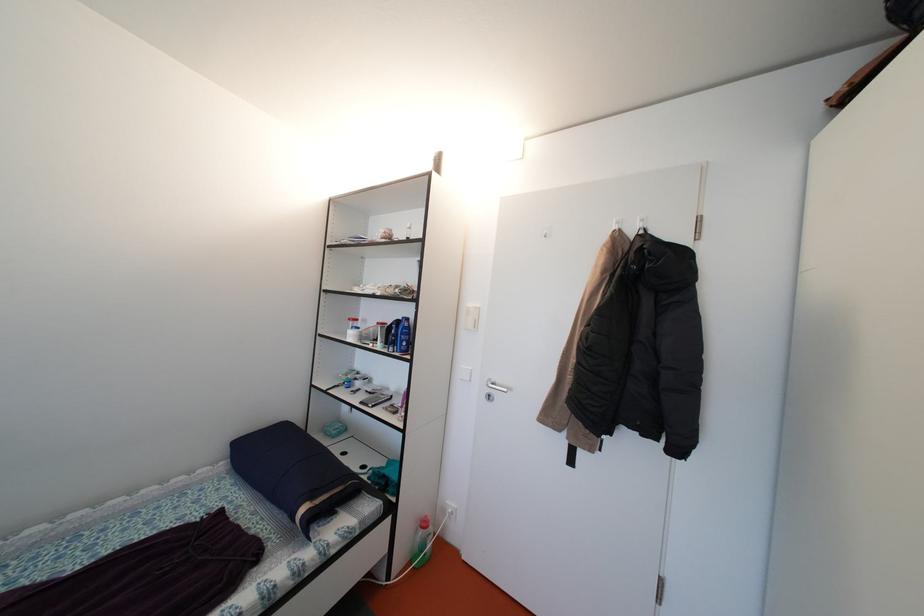
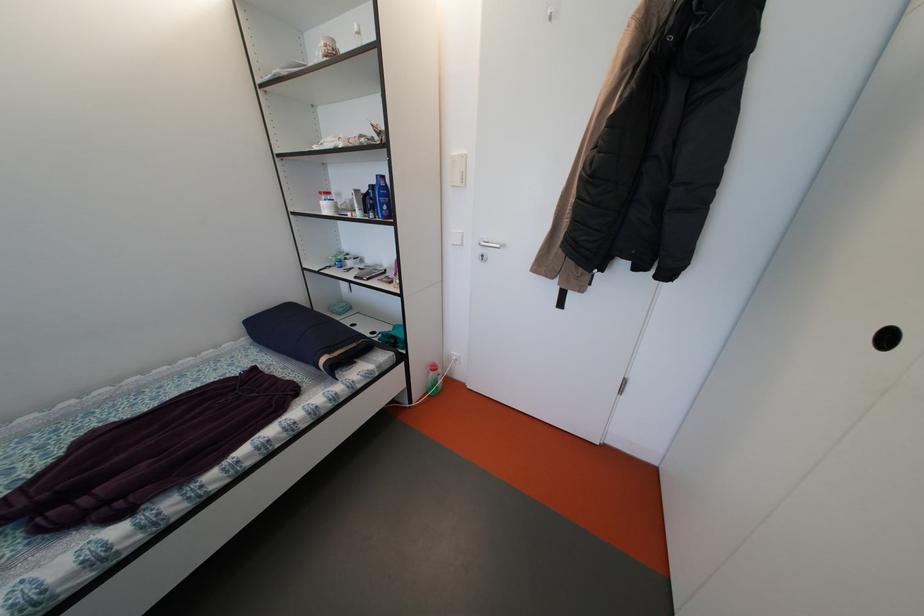
Where in the second image is the point corresponding to (x=357, y=323) from the first image?

(327, 198)